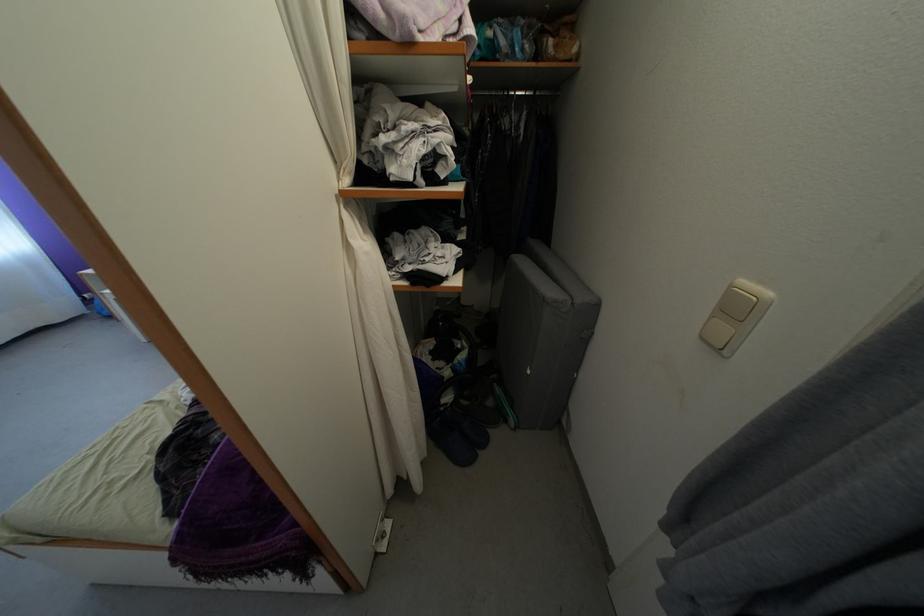
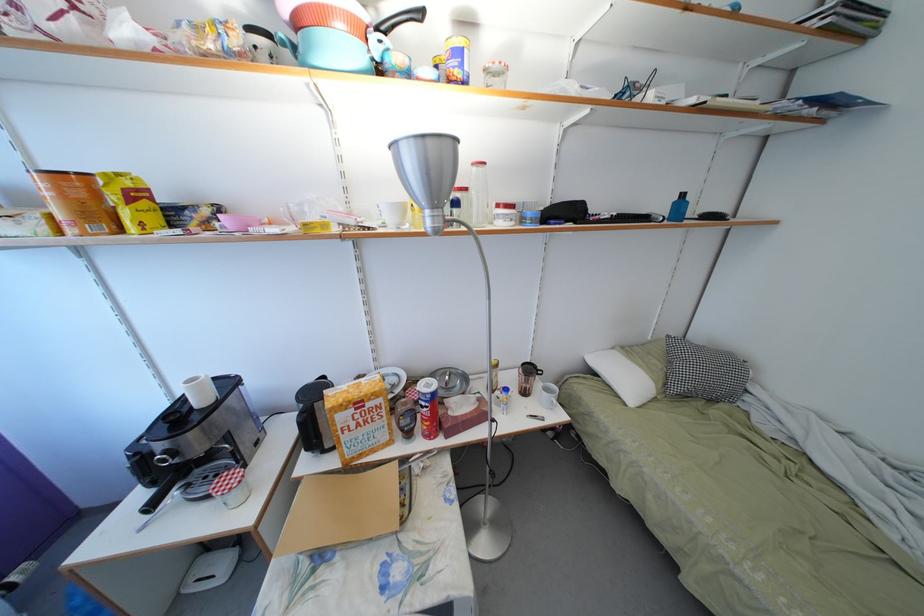
What movement of the cameraman would produce the second image?

The cameraman walked toward left, forward.